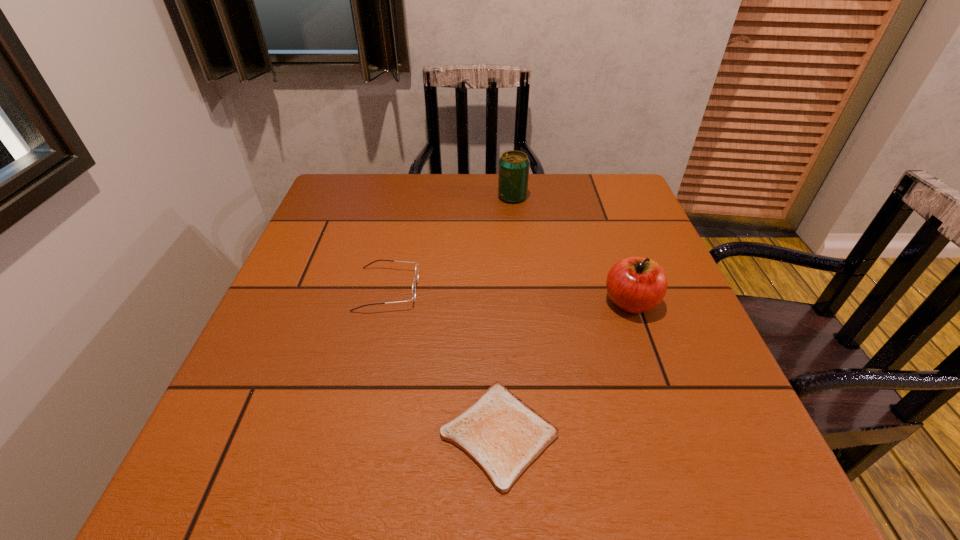
The width and height of the screenshot is (960, 540). I want to click on object that is positioned at the far edge, so click(513, 175).

Locate an element on the screen. The width and height of the screenshot is (960, 540). object at the near edge is located at coordinates (503, 435).

Identify the location of object that is at the right edge. (635, 284).

The width and height of the screenshot is (960, 540). Identify the location of vacant area at the far edge. tap(419, 186).

Locate an element on the screen. free space at the left edge of the desktop is located at coordinates pyautogui.click(x=341, y=222).

This screenshot has height=540, width=960. I want to click on vacant space at the right edge, so click(630, 220).

Find the location of a particular element. The image size is (960, 540). vacant space at the far left corner is located at coordinates 339,176.

Where is `vacant space at the far right corner`? The width and height of the screenshot is (960, 540). vacant space at the far right corner is located at coordinates (615, 207).

In the image, there is a desktop. Where is `free space at the near right corner`? The width and height of the screenshot is (960, 540). free space at the near right corner is located at coordinates (743, 451).

The width and height of the screenshot is (960, 540). Identify the location of free space between the shortest object and the spectacles. (444, 362).